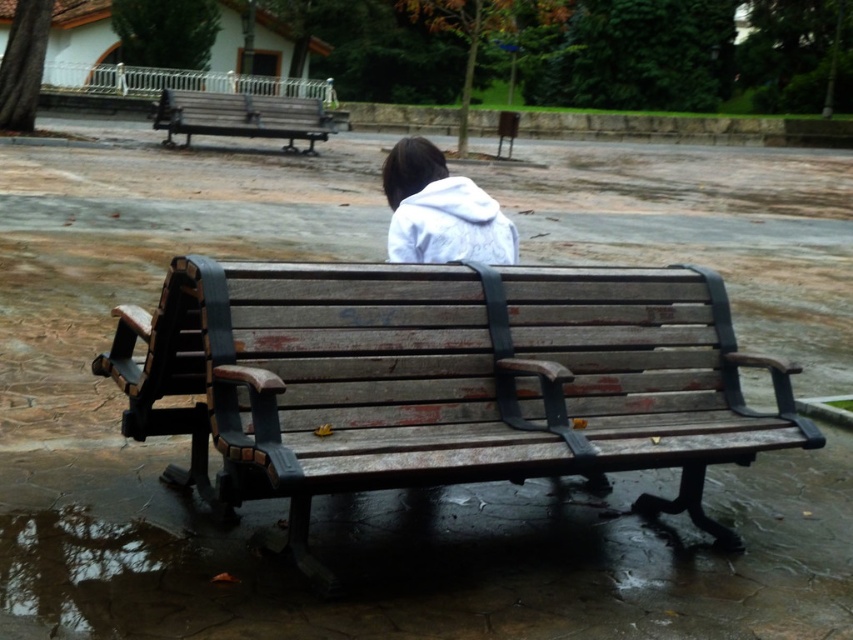
You are a photographer trying to capture a shot of the white fleece jacket at center and the weathered wood bench at upper left. If you want to ensure both are in focus, which object should you adjust your camera focus to prioritize based on their height?

The white fleece jacket at center is not as tall as the weathered wood bench at upper left, so you should prioritize focusing on the taller weathered wood bench at upper left to ensure both are in focus.

You are standing in the park and want to take a photo of the two points marked in the scene. Which point, point (502, 225) or point (216, 102), will appear larger in your camera view?

Point (502, 225) will appear larger in the camera view because it is closer to the camera than point (216, 102).

You are a photographer aiming to capture the person in the white fleece jacket at center and the weathered wood bench at upper left in a single shot. Since the camera can only focus on one subject at a time, which object should you prioritize to ensure it is in focus if the bench is closer to the camera than the jacket?

You should prioritize focusing on the weathered wood bench at upper left because it is closer to the camera than the white fleece jacket at center, and objects closer to the camera are more in focus when focusing on them.